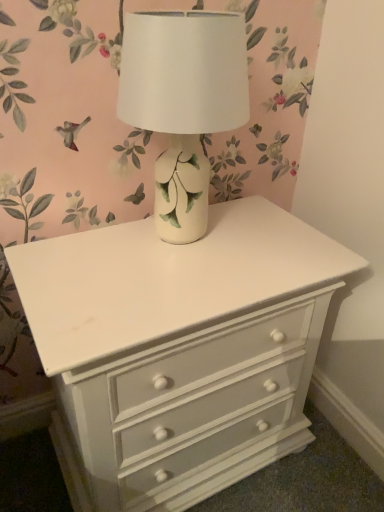
Image resolution: width=384 pixels, height=512 pixels. Find the location of `unoccupied region to the right of white ceramic table lamp at center`. unoccupied region to the right of white ceramic table lamp at center is located at coordinates (279, 241).